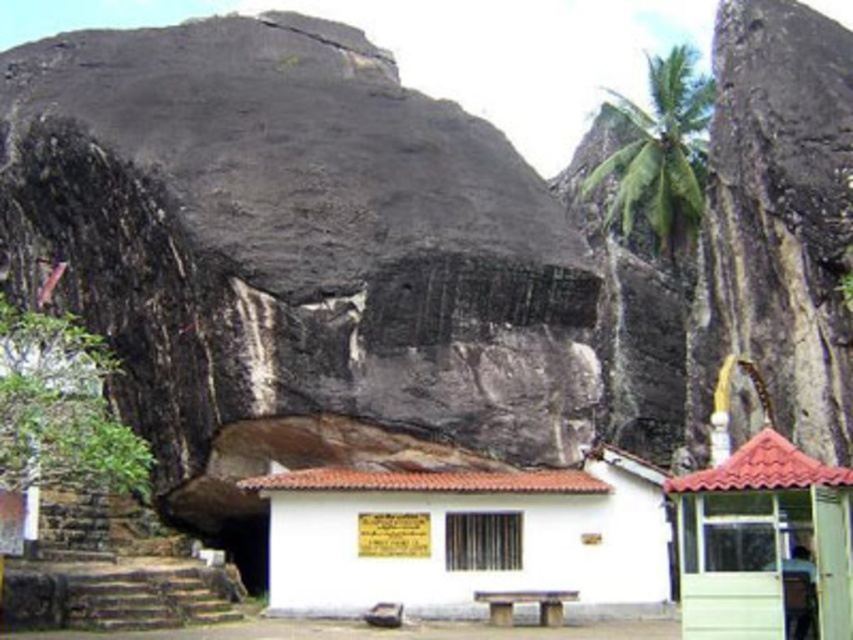
Who is shorter, white painted wood hut at center or green leafy palm tree at upper right?

white painted wood hut at center is shorter.

Does white painted wood hut at center have a greater height compared to green leafy palm tree at upper right?

In fact, white painted wood hut at center may be shorter than green leafy palm tree at upper right.

Which is in front, point (410, 605) or point (695, 86)?

Positioned in front is point (410, 605).

The image size is (853, 640). Identify the location of white painted wood hut at center. (467, 538).

Can you confirm if white painted wood hut at center is positioned to the right of green plastic hut at lower right?

No, white painted wood hut at center is not to the right of green plastic hut at lower right.

Is white painted wood hut at center above green plastic hut at lower right?

No, white painted wood hut at center is not above green plastic hut at lower right.

The height and width of the screenshot is (640, 853). What do you see at coordinates (467, 538) in the screenshot? I see `white painted wood hut at center` at bounding box center [467, 538].

Where is `white painted wood hut at center`? This screenshot has width=853, height=640. white painted wood hut at center is located at coordinates (467, 538).

Between point (729, 630) and point (653, 140), which one is positioned behind?

Point (653, 140)

Which is more to the right, green plastic hut at lower right or green leafy palm tree at upper right?

green leafy palm tree at upper right

The image size is (853, 640). I want to click on green plastic hut at lower right, so click(x=761, y=540).